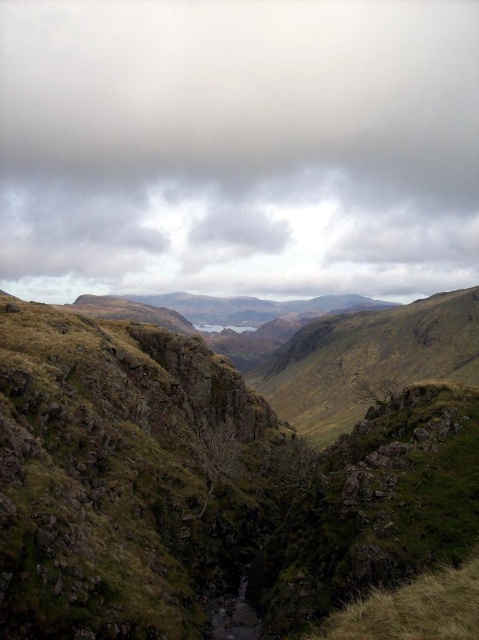
Question: From the image, what is the correct spatial relationship of gray cloudy sky at upper center in relation to green grassy terrain at center?

Choices:
 (A) below
 (B) above

Answer: (B)

Question: Among these objects, which one is nearest to the camera?

Choices:
 (A) green grassy terrain at center
 (B) gray cloudy sky at upper center

Answer: (A)

Question: Is the position of gray cloudy sky at upper center more distant than that of green grassy terrain at center?

Choices:
 (A) yes
 (B) no

Answer: (A)

Question: Can you confirm if gray cloudy sky at upper center is wider than green grassy terrain at center?

Choices:
 (A) yes
 (B) no

Answer: (A)